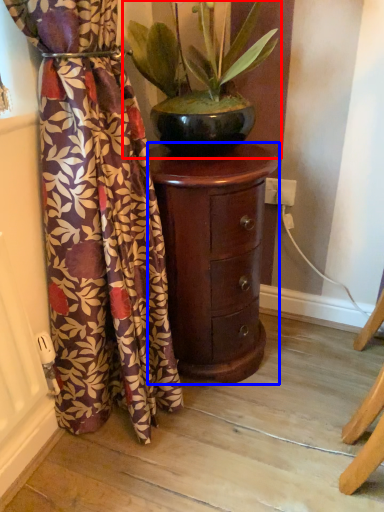
Question: Which object is further to the camera taking this photo, houseplant (highlighted by a red box) or furniture (highlighted by a blue box)?

Choices:
 (A) houseplant
 (B) furniture

Answer: (B)